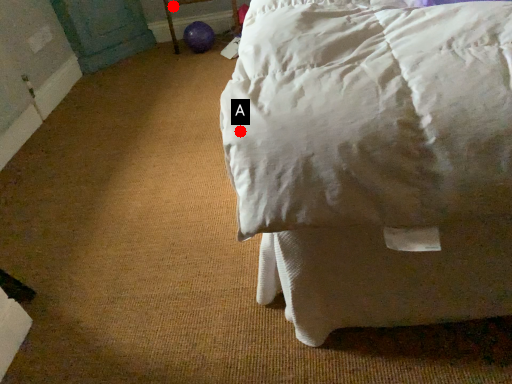
Question: Two points are circled on the image, labeled by A and B beside each circle. Which point is farther to the camera?

Choices:
 (A) A is further
 (B) B is further

Answer: (B)